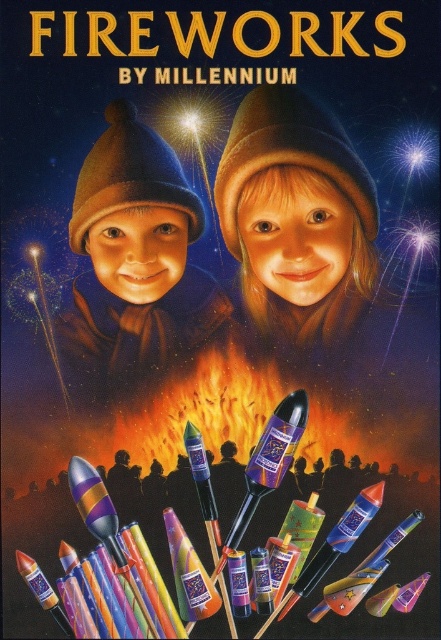
You are looking at the fireworks poster and notice two points labeled as point 1 and point 2. If point 1 is at coordinate point [235,195] and point 2 is at coordinate point [141,364], which point is closer to your eyes?

Point [235,195] is closer to the camera than point [141,364].

What is located at the coordinates point (298, 218) in the image?

The smooth brown hat at center is located at point (298, 218).

You are at a fireworks display and want to find the taller hat between the smooth brown hat at center and the matte brown hat at center. Which one should you look for?

The matte brown hat at center is taller than the smooth brown hat at center, so you should look for the matte brown hat at center.